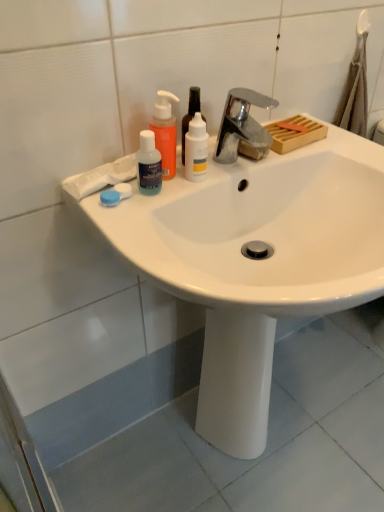
At what (x,y) coordinates should I click in order to perform the action: click on free space in front of white glossy bottle at center, arranged as the first mouthwash when viewed from the right. Please return your answer as a coordinate pair (x, y). Image resolution: width=384 pixels, height=512 pixels. Looking at the image, I should click on (x=154, y=223).